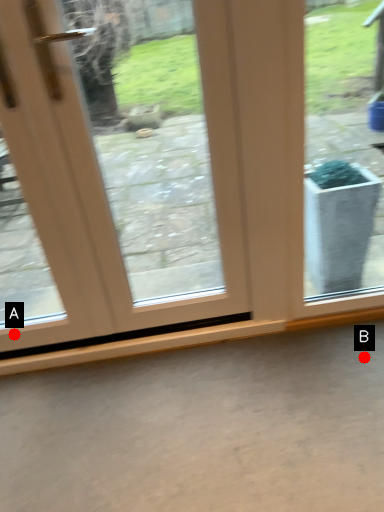
Question: Two points are circled on the image, labeled by A and B beside each circle. Among these points, which one is farthest from the camera?

Choices:
 (A) A is further
 (B) B is further

Answer: (A)